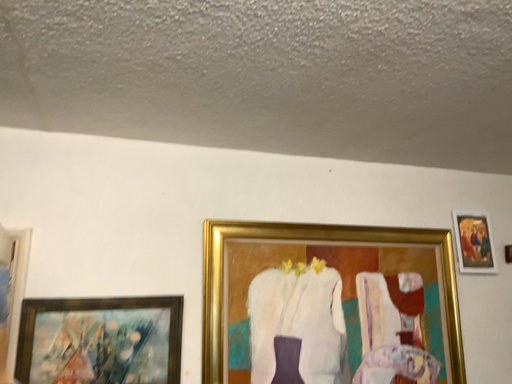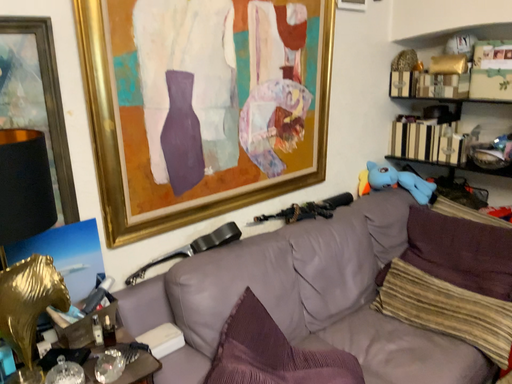
Question: Which way did the camera rotate in the video?

Choices:
 (A) rotated downward
 (B) rotated upward

Answer: (A)